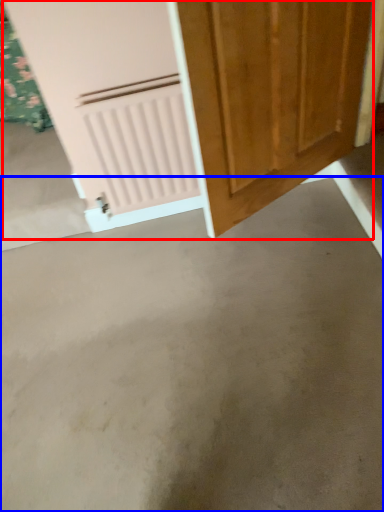
Question: Which of the following is the closest to the observer, door (highlighted by a red box) or concrete (highlighted by a blue box)?

Choices:
 (A) door
 (B) concrete

Answer: (A)